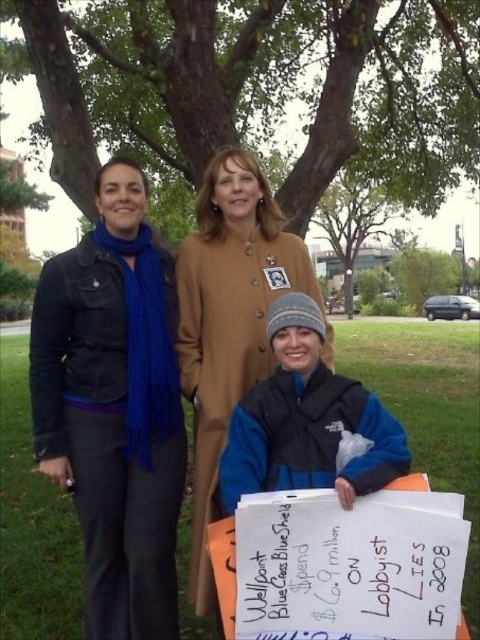
Question: Is blue matte scarf at left to the left of blue fleece jacket at center from the viewer's perspective?

Choices:
 (A) yes
 (B) no

Answer: (A)

Question: Is blue matte scarf at left positioned behind blue fleece jacket at center?

Choices:
 (A) yes
 (B) no

Answer: (A)

Question: Which of the following is the farthest from the observer?

Choices:
 (A) (226, 291)
 (B) (40, 348)
 (C) (442, 216)

Answer: (C)

Question: Does blue fleece jacket at center appear on the left side of green leafy tree at center?

Choices:
 (A) yes
 (B) no

Answer: (A)

Question: Which object is farther from the camera taking this photo?

Choices:
 (A) green leafy tree at center
 (B) blue fleece jacket at center

Answer: (A)

Question: Considering the real-world distances, which object is closest to the green leafy tree at center?

Choices:
 (A) matte brown coat at center
 (B) blue fleece jacket at center
 (C) blue matte scarf at left

Answer: (A)